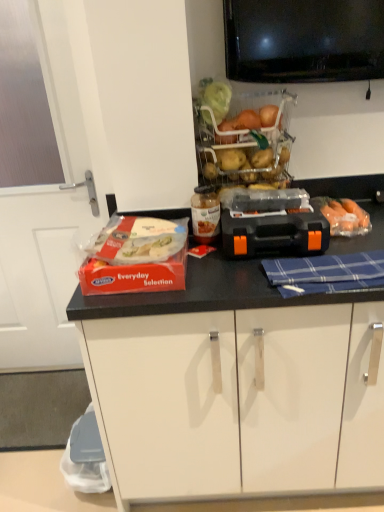
Question: Is black plastic toolbox at center inside or outside of blue plaid cloth at center?

Choices:
 (A) outside
 (B) inside

Answer: (A)

Question: Considering the positions of black plastic toolbox at center and blue plaid cloth at center in the image, is black plastic toolbox at center wider or thinner than blue plaid cloth at center?

Choices:
 (A) wide
 (B) thin

Answer: (A)

Question: Which of these objects is positioned closest to the translucent plastic basket at upper center?

Choices:
 (A) black plastic toolbox at center
 (B) translucent plastic food at center left, marked as the 1th food in a left-to-right arrangement
 (C) translucent plastic carrots at right, the first food positioned from the right
 (D) blue plaid cloth at center
 (E) white glossy door at left

Answer: (A)

Question: Which object is the closest to the black plastic toolbox at center?

Choices:
 (A) translucent plastic carrots at right, the first food positioned from the right
 (B) white glossy door at left
 (C) blue plaid cloth at center
 (D) translucent plastic food at center left, which appears as the 2th food when viewed from the right
 (E) translucent plastic basket at upper center

Answer: (C)